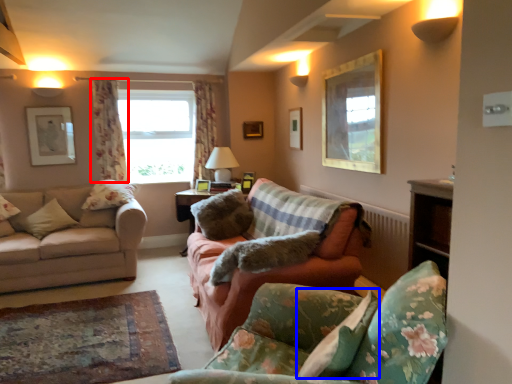
Question: Which of the following is the farthest to the observer, curtain (highlighted by a red box) or pillow (highlighted by a blue box)?

Choices:
 (A) curtain
 (B) pillow

Answer: (A)